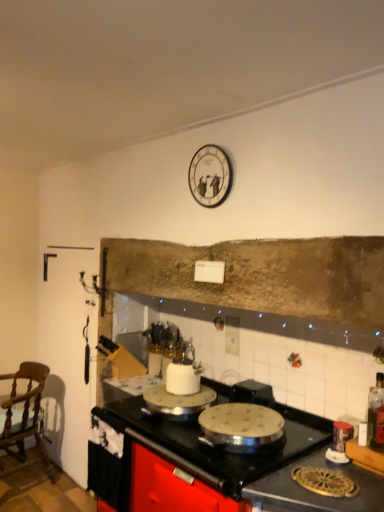
Question: From the image's perspective, is wooden chair at left on white glossy clock at upper center?

Choices:
 (A) yes
 (B) no

Answer: (B)

Question: Can you confirm if wooden chair at left is shorter than white glossy clock at upper center?

Choices:
 (A) no
 (B) yes

Answer: (A)

Question: From a real-world perspective, is wooden chair at left below white glossy clock at upper center?

Choices:
 (A) yes
 (B) no

Answer: (A)

Question: Is wooden chair at left looking in the opposite direction of white glossy clock at upper center?

Choices:
 (A) yes
 (B) no

Answer: (B)

Question: Is wooden chair at left positioned far away from white glossy clock at upper center?

Choices:
 (A) no
 (B) yes

Answer: (B)

Question: In terms of height, does black matte countertop at center look taller or shorter compared to wooden chair at left?

Choices:
 (A) tall
 (B) short

Answer: (A)

Question: From the image's perspective, is black matte countertop at center positioned above or below wooden chair at left?

Choices:
 (A) above
 (B) below

Answer: (A)

Question: Is black matte countertop at center wider or thinner than wooden chair at left?

Choices:
 (A) wide
 (B) thin

Answer: (A)

Question: In terms of size, does black matte countertop at center appear bigger or smaller than wooden chair at left?

Choices:
 (A) small
 (B) big

Answer: (B)

Question: Is translucent glass bottle at right bigger or smaller than wooden chair at left?

Choices:
 (A) small
 (B) big

Answer: (A)

Question: Considering the positions of point (372, 391) and point (43, 374), is point (372, 391) closer or farther from the camera than point (43, 374)?

Choices:
 (A) farther
 (B) closer

Answer: (B)

Question: Is translucent glass bottle at right wider or thinner than wooden chair at left?

Choices:
 (A) thin
 (B) wide

Answer: (A)

Question: Considering the relative positions of translucent glass bottle at right and wooden chair at left in the image provided, is translucent glass bottle at right to the left or to the right of wooden chair at left?

Choices:
 (A) left
 (B) right

Answer: (B)

Question: In terms of width, does wooden chair at left look wider or thinner when compared to black matte countertop at center?

Choices:
 (A) wide
 (B) thin

Answer: (B)

Question: From a real-world perspective, is wooden chair at left positioned above or below black matte countertop at center?

Choices:
 (A) above
 (B) below

Answer: (B)